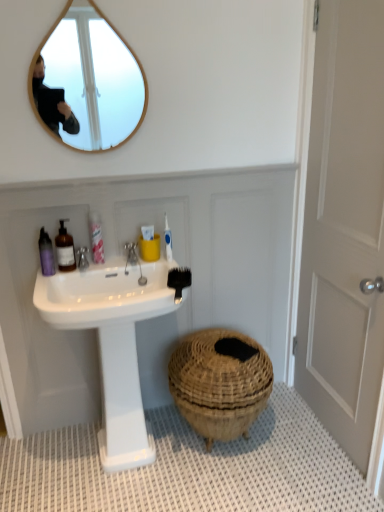
Question: From the image's perspective, is pink plastic bottle at upper left, the 3th toiletry in the left-to-right sequence, on white textured bath mat at lower center?

Choices:
 (A) no
 (B) yes

Answer: (B)

Question: Is pink plastic bottle at upper left, the 3th toiletry in the left-to-right sequence, oriented away from white textured bath mat at lower center?

Choices:
 (A) yes
 (B) no

Answer: (B)

Question: Is there a large distance between pink plastic bottle at upper left, the 3th toiletry in the left-to-right sequence, and white textured bath mat at lower center?

Choices:
 (A) yes
 (B) no

Answer: (A)

Question: Is pink plastic bottle at upper left, the 3th toiletry in the left-to-right sequence, oriented towards white textured bath mat at lower center?

Choices:
 (A) no
 (B) yes

Answer: (A)

Question: Does pink plastic bottle at upper left, the first toiletry viewed from the right, have a greater width compared to white textured bath mat at lower center?

Choices:
 (A) no
 (B) yes

Answer: (A)

Question: From the image's perspective, is pink plastic bottle at upper left, the first toiletry viewed from the right, beneath white textured bath mat at lower center?

Choices:
 (A) no
 (B) yes

Answer: (A)

Question: Is brown woven basket at lower center oriented away from white matte door at right?

Choices:
 (A) no
 (B) yes

Answer: (A)

Question: Is white matte door at right surrounded by brown woven basket at lower center?

Choices:
 (A) no
 (B) yes

Answer: (A)

Question: From a real-world perspective, is brown woven basket at lower center beneath white matte door at right?

Choices:
 (A) no
 (B) yes

Answer: (B)

Question: Can you confirm if brown woven basket at lower center is taller than white matte door at right?

Choices:
 (A) yes
 (B) no

Answer: (B)

Question: Is brown woven basket at lower center at the left side of white matte door at right?

Choices:
 (A) no
 (B) yes

Answer: (B)

Question: Could you tell me if brown woven basket at lower center is turned towards white matte door at right?

Choices:
 (A) yes
 (B) no

Answer: (B)

Question: Considering the relative sizes of silver metallic faucet at upper center and white glossy sink at center in the image provided, is silver metallic faucet at upper center smaller than white glossy sink at center?

Choices:
 (A) yes
 (B) no

Answer: (A)